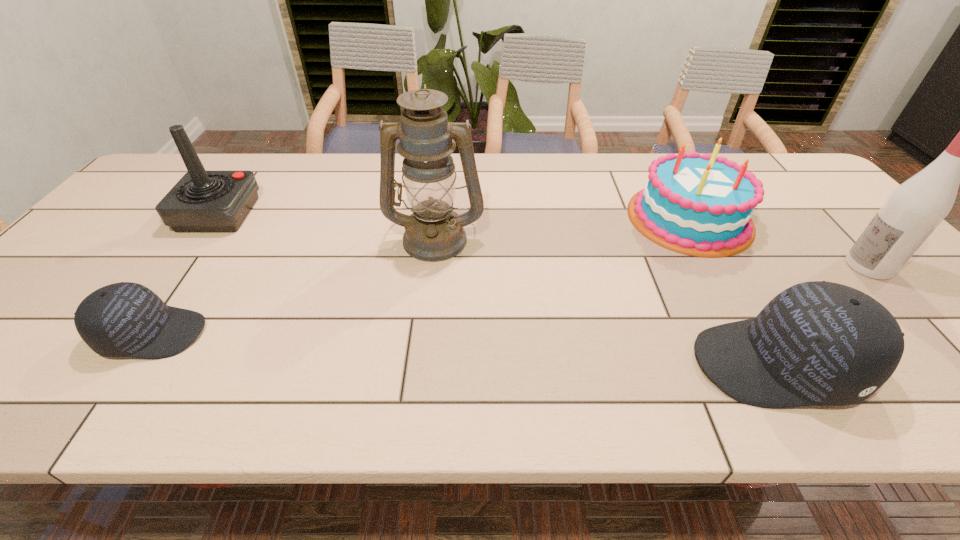
Find the location of `unoccupied position between the right baseball cap and the birthday cake`. unoccupied position between the right baseball cap and the birthday cake is located at coordinates (732, 291).

Where is `vacant area that lies between the shortest object and the taller baseball cap`? The height and width of the screenshot is (540, 960). vacant area that lies between the shortest object and the taller baseball cap is located at coordinates (465, 349).

Image resolution: width=960 pixels, height=540 pixels. What are the coordinates of `vacant space that is in between the fourth object from right to left and the birthday cake` in the screenshot? It's located at (563, 228).

Locate an element on the screen. This screenshot has width=960, height=540. vacant space that's between the oil lamp and the taller baseball cap is located at coordinates (606, 301).

Where is `empty location between the shortest object and the birthday cake`? This screenshot has height=540, width=960. empty location between the shortest object and the birthday cake is located at coordinates (421, 276).

What are the coordinates of `free space that is in between the birthday cake and the shortest object` in the screenshot? It's located at (421, 276).

Where is `object that is the nearest to the oil lamp`? This screenshot has height=540, width=960. object that is the nearest to the oil lamp is located at coordinates (125, 319).

Locate an element on the screen. The height and width of the screenshot is (540, 960). object that is the second closest to the third tallest object is located at coordinates (433, 232).

The height and width of the screenshot is (540, 960). In order to click on free space that satisfies the following two spatial constraints: 1. on the front side of the fourth object from right to left; 2. at the front of the shortest object where the brim is located in this screenshot , I will do `click(424, 334)`.

The width and height of the screenshot is (960, 540). I want to click on vacant space that satisfies the following two spatial constraints: 1. on the front-facing side of the fourth object from right to left; 2. on the right side of the fourth shortest object, so click(x=201, y=238).